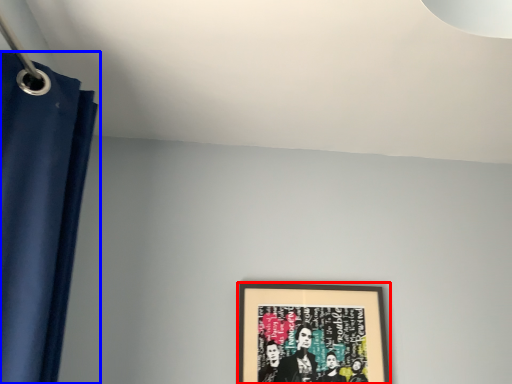
Question: Which object appears farthest to the camera in this image, picture frame (highlighted by a red box) or curtain (highlighted by a blue box)?

Choices:
 (A) picture frame
 (B) curtain

Answer: (A)